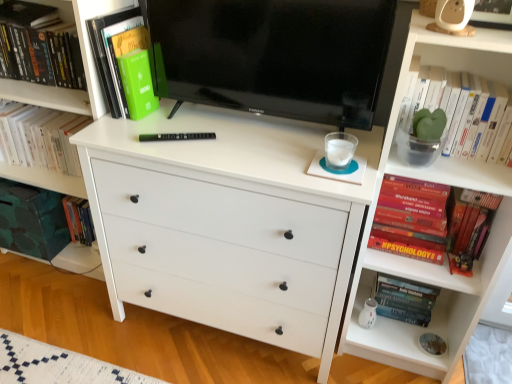
You are a GUI agent. You are given a task and a screenshot of the screen. Output one action in this format:
    pyautogui.click(x=<x>, y=<y>)
    Task: Click on the free space in front of black glossy tv at center
    The image size is (512, 384).
    Given the screenshot: What is the action you would take?
    pyautogui.click(x=255, y=155)